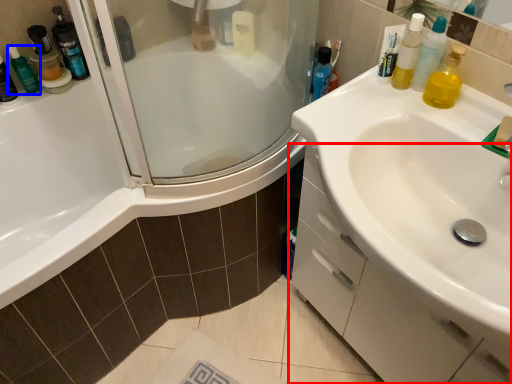
Question: Which object appears closest to the camera in this image, bathroom cabinet (highlighted by a red box) or toiletry (highlighted by a blue box)?

Choices:
 (A) bathroom cabinet
 (B) toiletry

Answer: (A)